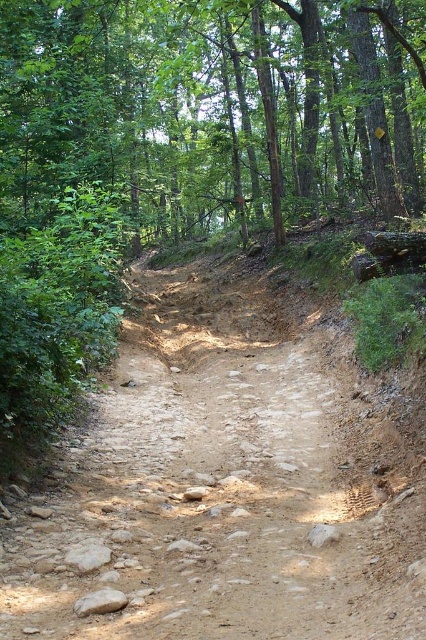
Question: Considering the relative positions of brown dirt track at center and gray rough rock at lower left in the image provided, where is brown dirt track at center located with respect to gray rough rock at lower left?

Choices:
 (A) left
 (B) right

Answer: (B)

Question: Which point is closer to the camera?

Choices:
 (A) brown dirt track at center
 (B) green leafy tree at upper center

Answer: (A)

Question: Which object appears farthest from the camera in this image?

Choices:
 (A) gray rough rock at lower left
 (B) gray rough rock at center

Answer: (A)

Question: Does brown dirt track at center have a lesser width compared to gray rough rock at center?

Choices:
 (A) yes
 (B) no

Answer: (B)

Question: Does brown dirt track at center have a greater width compared to gray rough rock at center?

Choices:
 (A) yes
 (B) no

Answer: (A)

Question: Which point is closer to the camera taking this photo?

Choices:
 (A) (83, 605)
 (B) (29, 209)

Answer: (A)